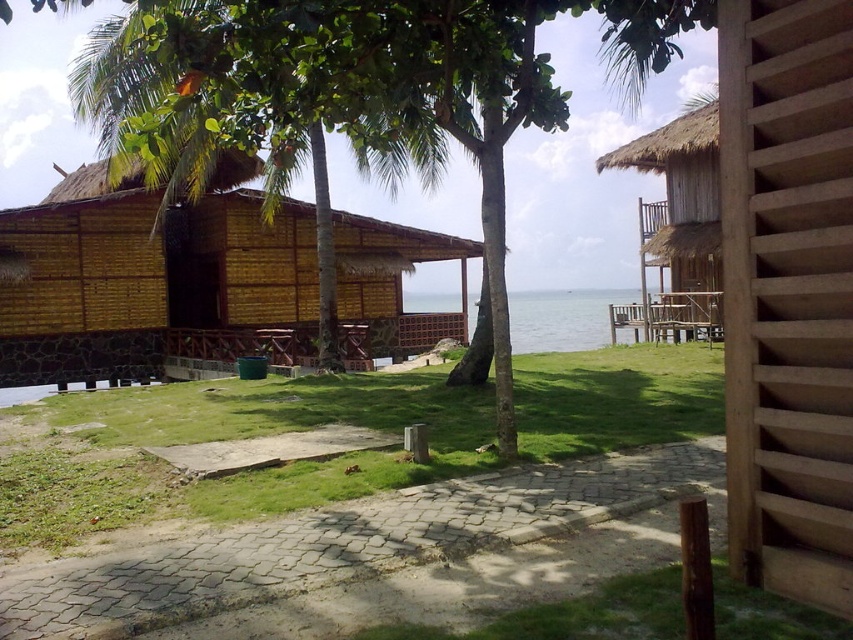
You are a guest staying at the resort and want to find the thatched bamboo hut at upper right. From your current position at the green grass at center, which direction should you walk to reach it?

The thatched bamboo hut at upper right is located above the green grass at center, so you should walk upwards or towards the upper part of the scene to reach it.

You are planning to build a small garden between the thatched bamboo hut at upper right and the clear blue water at center. Considering their widths, which object will require more space to accommodate the garden on its side?

The clear blue water at center is wider than the thatched bamboo hut at upper right, so the garden will need more space on the side of the clear blue water at center.

You are a visitor at the resort and want to take a photo of the thatched bamboo hut at upper right. However, you want to avoid including the green grass at center in your shot. Based on their positions, which direction should you move to frame the hut without the grass?

The green grass at center is to the left of the thatched bamboo hut at upper right. To avoid including the grass, you should move to the right side of the hut so that the grass is out of frame.